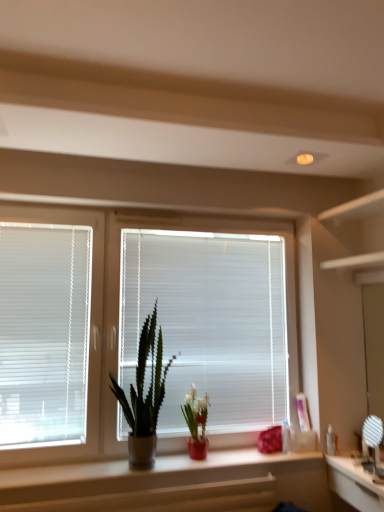
Question: From a real-world perspective, is white plastic blinds at left, the second window blind when ordered from right to left, above or below clear plastic bottle at right, arranged as the second toiletry when viewed from the left?

Choices:
 (A) above
 (B) below

Answer: (A)

Question: Relative to clear plastic bottle at right, arranged as the second toiletry when viewed from the left, is white plastic blinds at left, the second window blind when ordered from right to left, in front or behind?

Choices:
 (A) behind
 (B) front

Answer: (B)

Question: Which of these objects is positioned closest to the matte red vase at center, which is counted as the first houseplant, starting from the right?

Choices:
 (A) white plastic blinds at left, the second window blind when ordered from right to left
 (B) white plastic blinds at center, arranged as the 1th window blind when viewed from the right
 (C) smooth white counter at lower center
 (D) green matte cactus at center, the first houseplant viewed from the left
 (E) white plastic window at center

Answer: (D)

Question: Based on their relative distances, which object is farther from the matte plastic bottle at center, which ranks as the 1th toiletry in left-to-right order?

Choices:
 (A) smooth white counter at lower center
 (B) matte red vase at center, which is counted as the second houseplant, starting from the left
 (C) white glossy mirror at lower right
 (D) green matte cactus at center, the 2th houseplant when ordered from right to left
 (E) white plastic blinds at center, arranged as the 1th window blind when viewed from the right

Answer: (D)